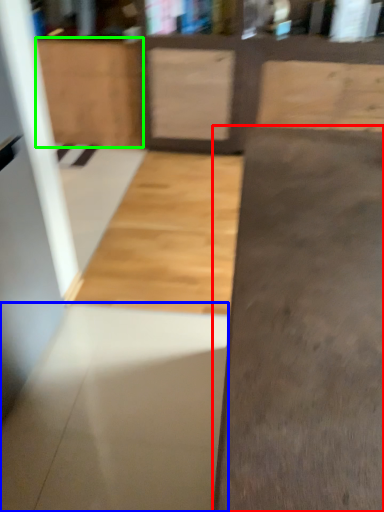
Question: Considering the real-world distances, which object is farthest from concrete (highlighted by a red box)? concrete (highlighted by a blue box) or cabinetry (highlighted by a green box)?

Choices:
 (A) concrete
 (B) cabinetry

Answer: (B)